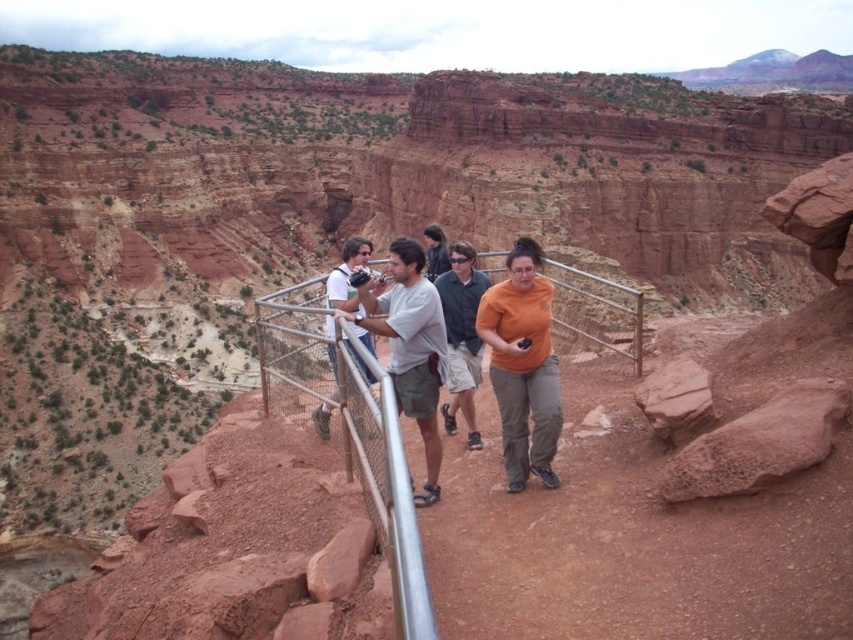
Who is lower down, silver metallic rail at center or orange matte shirt at center?

orange matte shirt at center is lower down.

Is silver metallic rail at center smaller than orange matte shirt at center?

No, silver metallic rail at center is not smaller than orange matte shirt at center.

Is point (351, 435) behind point (450, 276)?

No, it is in front of (450, 276).

Find the location of a particular element. silver metallic rail at center is located at coordinates (349, 429).

Who is positioned more to the right, silver metallic rail at center or matte white shirt at center?

matte white shirt at center

Who is more distant from viewer, (262, 310) or (357, 237)?

Point (357, 237)

Between point (415, 593) and point (329, 282), which one is positioned in front?

Point (415, 593) is in front.

Where is `silver metallic rail at center`? This screenshot has height=640, width=853. silver metallic rail at center is located at coordinates (349, 429).

In the scene shown: Is orange cotton shirt at center thinner than matte white shirt at center?

Correct, orange cotton shirt at center's width is less than matte white shirt at center's.

Is orange cotton shirt at center positioned before matte white shirt at center?

No, orange cotton shirt at center is further to the viewer.

Which is behind, point (544, 412) or point (334, 268)?

The point (334, 268) is more distant.

Where is `orange cotton shirt at center`? The width and height of the screenshot is (853, 640). orange cotton shirt at center is located at coordinates (521, 365).